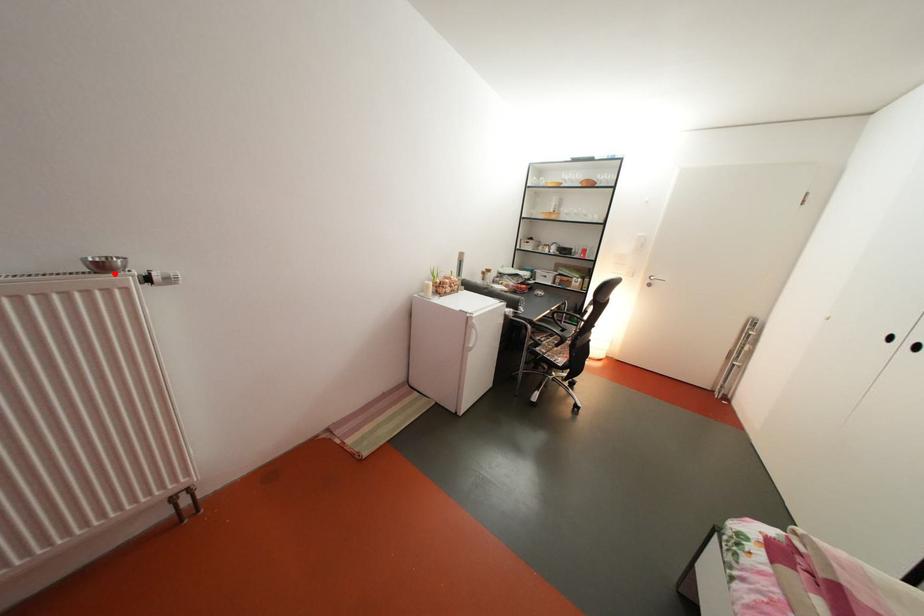
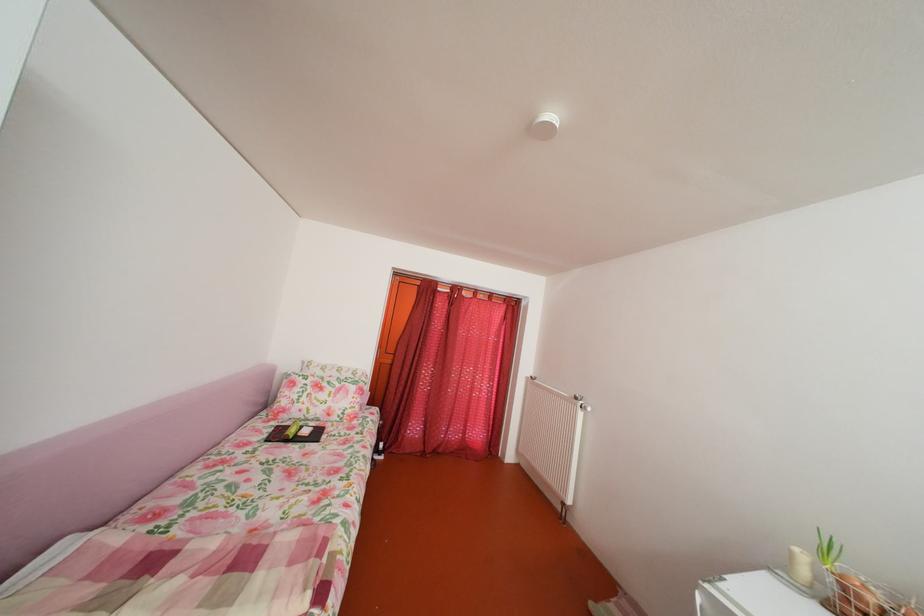
Where in the second image is the point corresponding to the highlighted location from the first image?

(588, 405)